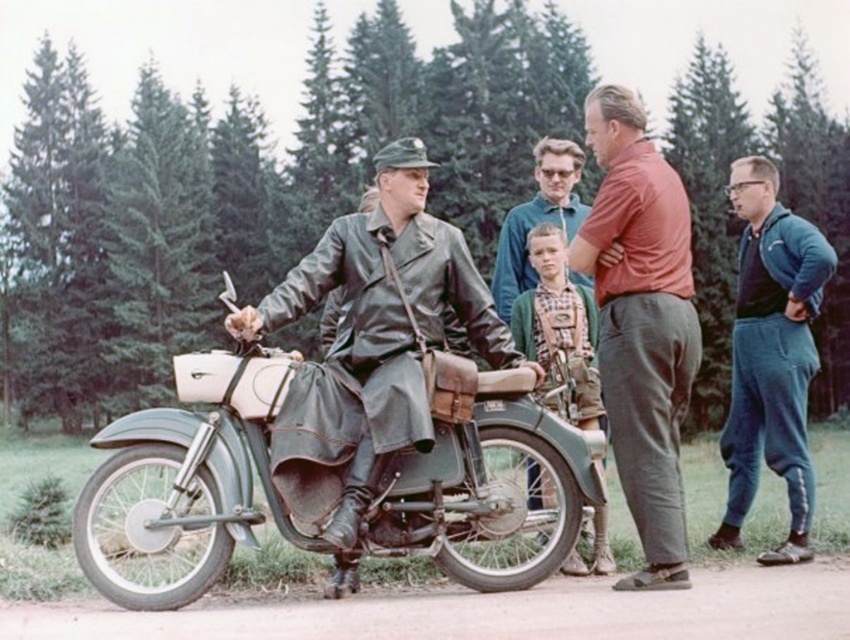
Is point (802, 404) positioned behind point (352, 355)?

Yes, point (802, 404) is farther from viewer.

Locate an element on the screen. dark blue sweatpants at right is located at coordinates (771, 356).

Is green leather jacket at center behind green knitted sweater at center?

No, it is in front of green knitted sweater at center.

Between green leather jacket at center and green knitted sweater at center, which one has less height?

With less height is green knitted sweater at center.

Describe the element at coordinates (383, 280) in the screenshot. The width and height of the screenshot is (850, 640). I see `green leather jacket at center` at that location.

The height and width of the screenshot is (640, 850). I want to click on green leather jacket at center, so click(383, 280).

Is green matte motorcycle at center closer to camera compared to green knitted sweater at center?

That is True.

Is point (151, 499) positioned in front of point (553, 273)?

Yes, point (151, 499) is closer to viewer.

You are a GUI agent. You are given a task and a screenshot of the screen. Output one action in this format:
    pyautogui.click(x=<x>, y=<y>)
    Task: Click on the green matte motorcycle at center
    The height and width of the screenshot is (640, 850).
    Given the screenshot: What is the action you would take?
    pyautogui.click(x=190, y=476)